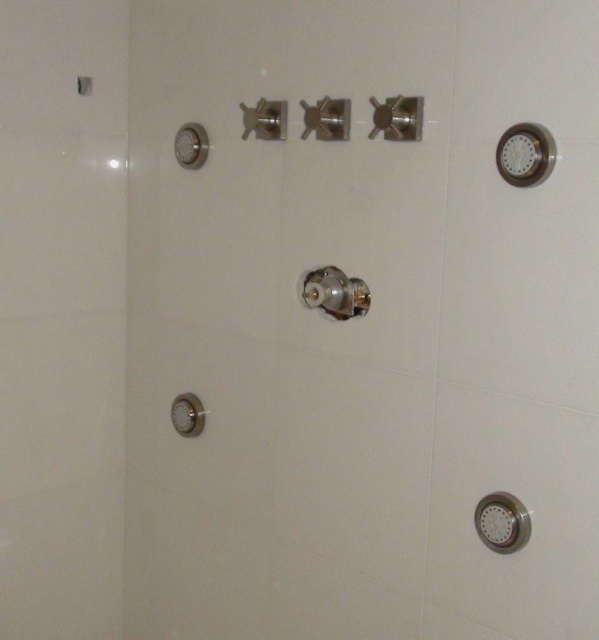
Is polished chrome shower at center below matte silver shower handle at lower left?

Actually, polished chrome shower at center is above matte silver shower handle at lower left.

In order to click on polished chrome shower at center in this screenshot , I will do `click(335, 292)`.

Where is `polished chrome shower at center`? The height and width of the screenshot is (640, 599). polished chrome shower at center is located at coordinates (335, 292).